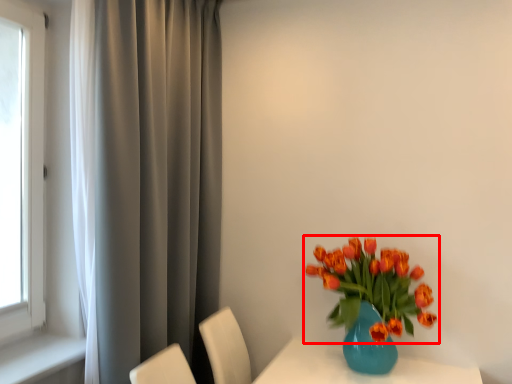
Question: From the image's perspective, where is flower (annotated by the red box) located in relation to curtain in the image?

Choices:
 (A) below
 (B) above

Answer: (A)